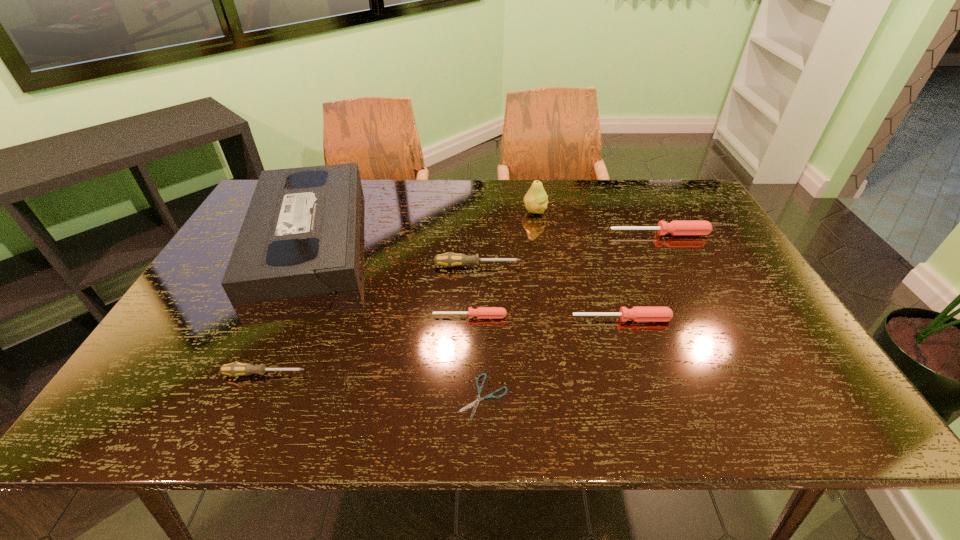
You are a GUI agent. You are given a task and a screenshot of the screen. Output one action in this format:
    pyautogui.click(x=<x>, y=<y>)
    Task: Click on the vacant region located 0.150m on the left of the smallest red screwdriver
    This screenshot has height=540, width=960.
    Given the screenshot: What is the action you would take?
    pyautogui.click(x=372, y=316)

Locate an element on the screen. The width and height of the screenshot is (960, 540). free point located on the right of the black shears is located at coordinates (696, 397).

Where is `pear that is at the far edge`? The width and height of the screenshot is (960, 540). pear that is at the far edge is located at coordinates pyautogui.click(x=536, y=200).

Locate an element on the screen. This screenshot has width=960, height=540. videotape that is at the far edge is located at coordinates coord(300,237).

Where is `object that is at the near edge`? object that is at the near edge is located at coordinates (475, 403).

Identify the location of object that is at the left edge. (300, 237).

Identify the location of object situated at the right edge. This screenshot has height=540, width=960. (677, 227).

Image resolution: width=960 pixels, height=540 pixels. In order to click on object that is at the far left corner in this screenshot , I will do `click(300, 237)`.

Image resolution: width=960 pixels, height=540 pixels. I want to click on vacant space at the far edge, so click(495, 184).

What are the coordinates of `vacant space at the near edge of the desktop` in the screenshot? It's located at (347, 415).